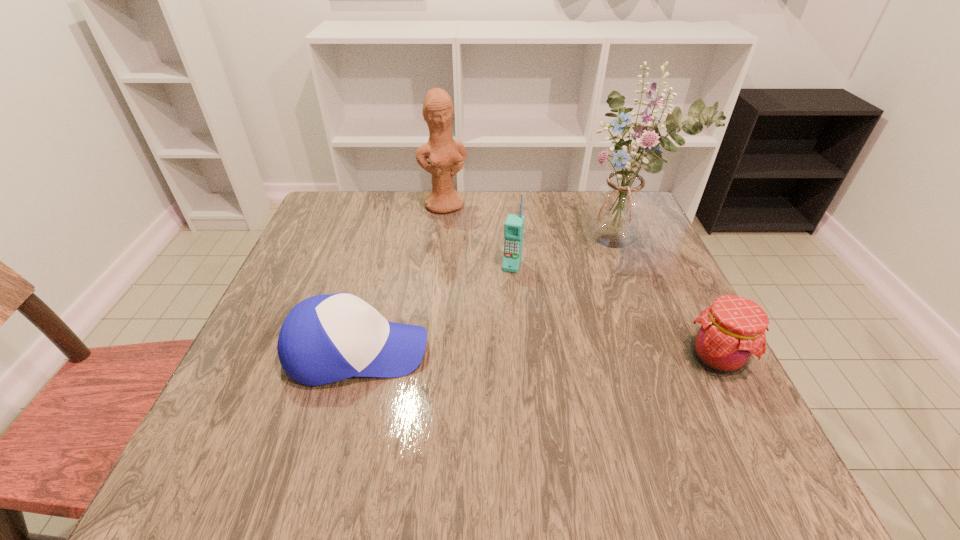
Image resolution: width=960 pixels, height=540 pixels. I want to click on free space on the desktop that is between the baseball cap and the jam and is positioned on the front-facing side of the bouquet, so click(x=491, y=354).

Identify the location of free spot on the desktop that is between the baseball cap and the jam and is positioned on the front-facing side of the second tallest object. (508, 354).

Locate an element on the screen. Image resolution: width=960 pixels, height=540 pixels. free space on the desktop that is between the baseball cap and the jam and is positioned on the keypad of the third object from left to right is located at coordinates (483, 354).